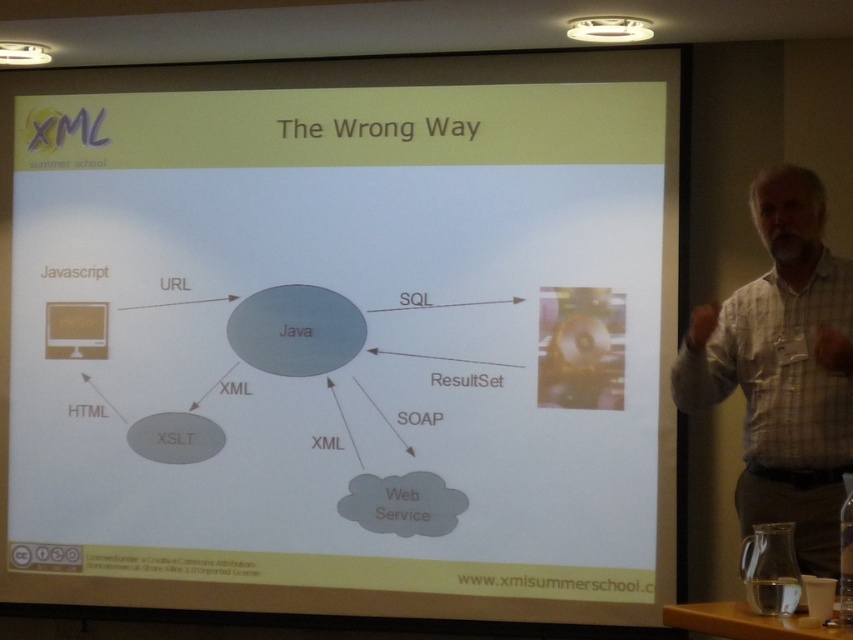
You are sitting in the front row of the seminar room and notice the white matte projector screen at upper center. Based on the coordinates provided in the description, can you determine if the screen is positioned to the left or right side of the room?

The white matte projector screen at upper center is located at point coordinates that are not explicitly described as left or right in the scene. The coordinates given are numerical values, but without a reference frame or axis definition, it is impossible to determine its left or right position relative to the room.

Looking at this image, you are sitting in the front row of the seminar and notice the white checkered shirt at right and the metallic projector at upper left. Which object is positioned further to the right side of the room?

The white checkered shirt at right is positioned further to the right side of the room compared to the metallic projector at upper left.

You are an attendee at the seminar and you want to take a photo of the screen to capture both the white checkered shirt at right and the metallic projector at upper left. Which object should you focus on to ensure both are in frame?

The white checkered shirt at right is larger than the metallic projector at upper left, so focusing on the shirt will help ensure both are in frame as it takes up more space in the image.